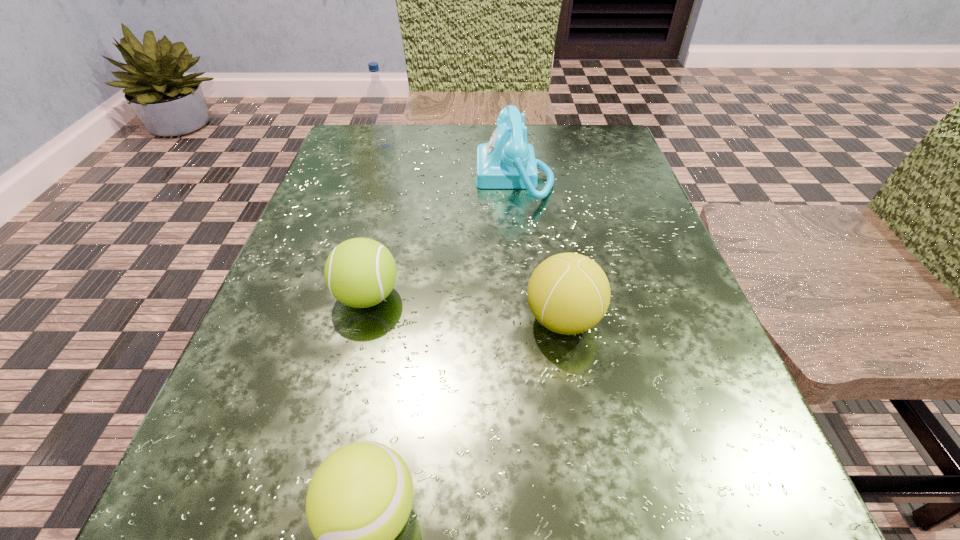
Find the location of a particular element. water bottle is located at coordinates (377, 94).

You are a GUI agent. You are given a task and a screenshot of the screen. Output one action in this format:
    pyautogui.click(x=<x>, y=<y>)
    Task: Click on the telephone
    This screenshot has height=540, width=960.
    Given the screenshot: What is the action you would take?
    pyautogui.click(x=507, y=161)

Find the location of a particular element. the rightmost tennis ball is located at coordinates (568, 293).

This screenshot has width=960, height=540. I want to click on vacant space located on the front of the water bottle, so [x=367, y=212].

The image size is (960, 540). In order to click on free space located 0.080m on the dial of the telephone in this screenshot , I will do [437, 177].

Identify the location of free space located on the dial of the telephone. 437,177.

Where is `free space located 0.250m on the dial of the telephone`? The height and width of the screenshot is (540, 960). free space located 0.250m on the dial of the telephone is located at coordinates (353, 177).

This screenshot has width=960, height=540. Find the location of `blank space located 0.250m on the left of the rightmost tennis ball`. blank space located 0.250m on the left of the rightmost tennis ball is located at coordinates (349, 320).

Find the location of a particular element. water bottle located at the far edge is located at coordinates (377, 94).

In order to click on telephone that is at the far edge in this screenshot , I will do `click(507, 161)`.